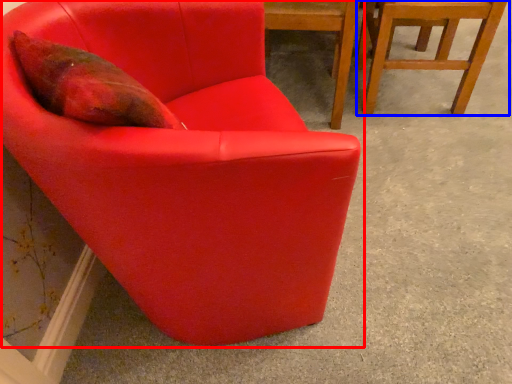
Question: Which of the following is the closest to the observer, chair (highlighted by a red box) or chair (highlighted by a blue box)?

Choices:
 (A) chair
 (B) chair

Answer: (A)